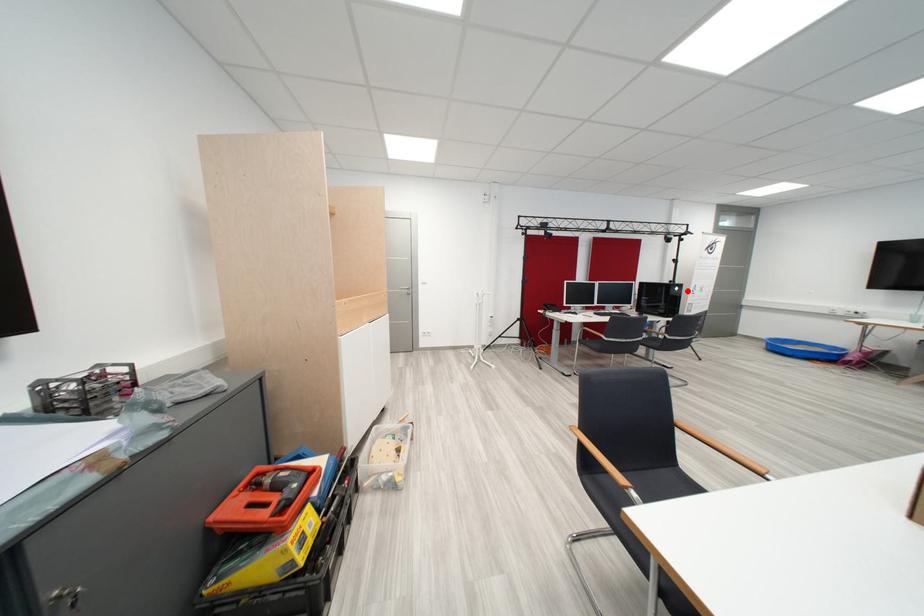
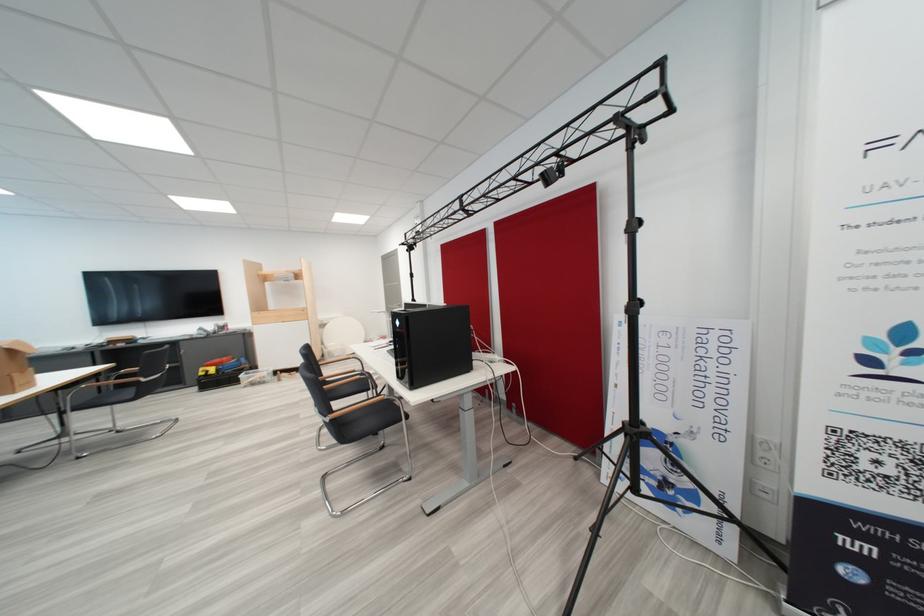
Question: I am providing you with two images of the same scene from different viewpoints. Image1 has a red point marked. In image2, the corresponding 3D location appears at what relative position? Reply with the corresponding letter.

Choices:
 (A) Closer
 (B) Farther

Answer: (B)